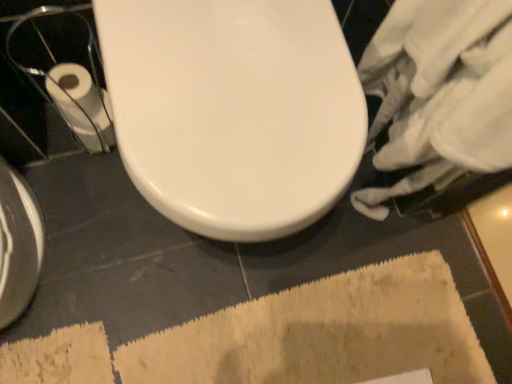
At what (x,y) coordinates should I click in order to perform the action: click on vacant area situated below beige textured bath mat at lower center (from a real-world perspective). Please return your answer as a coordinate pair (x, y). This screenshot has width=512, height=384. Looking at the image, I should click on (275, 338).